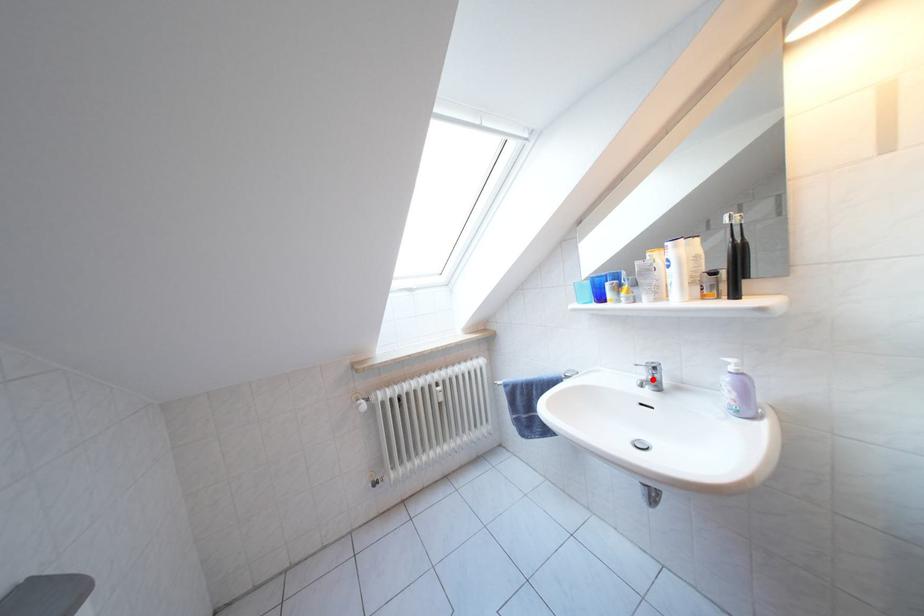
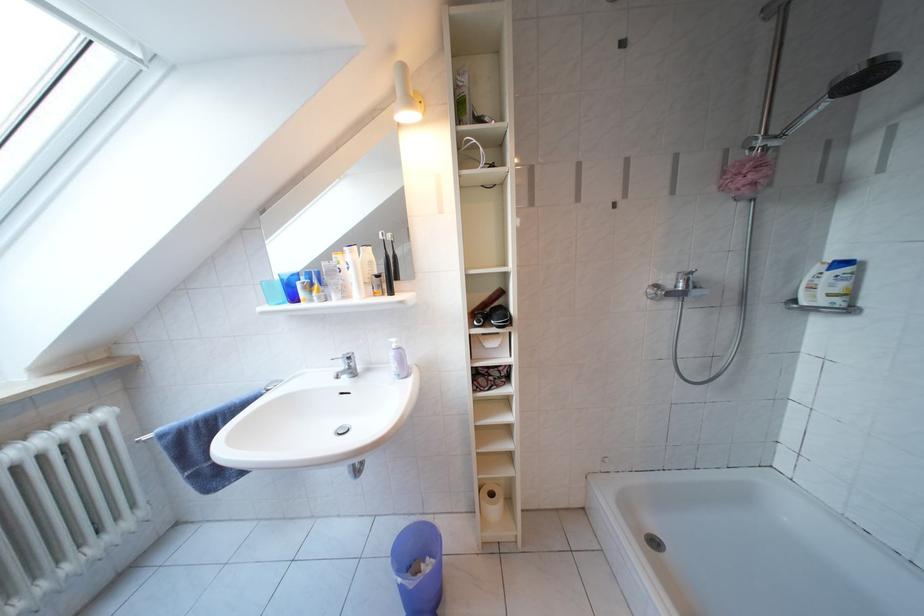
In the second image, find the point that corresponds to the highlighted location in the first image.

(349, 371)